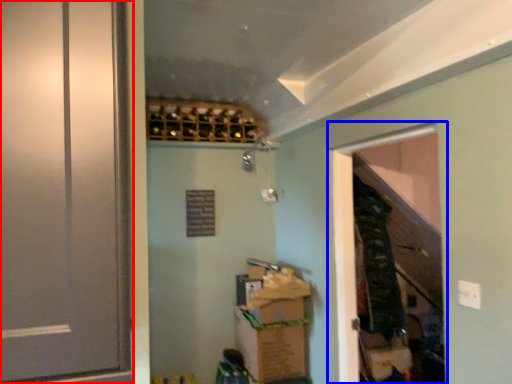
Question: Which of the following is the closest to the observer, door (highlighted by a red box) or screen door (highlighted by a blue box)?

Choices:
 (A) door
 (B) screen door

Answer: (A)